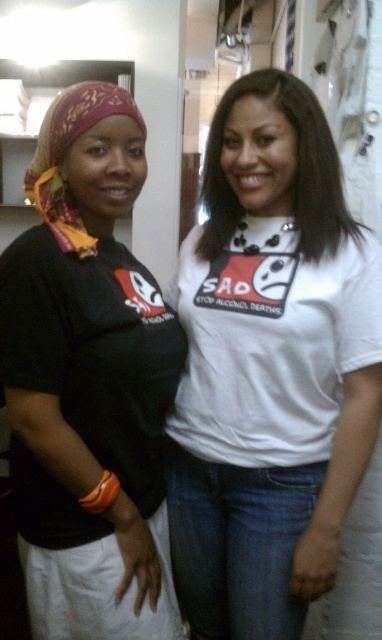
Question: Among these objects, which one is farthest from the camera?

Choices:
 (A) matte black shirt at left
 (B) white matte t-shirt at center

Answer: (B)

Question: Is white matte t-shirt at center further to camera compared to matte black shirt at left?

Choices:
 (A) no
 (B) yes

Answer: (B)

Question: Considering the real-world distances, which object is farthest from the white matte t-shirt at center?

Choices:
 (A) matte black shirt at left
 (B) printed silk headscarf at left

Answer: (B)

Question: In this image, where is white matte t-shirt at center located relative to printed silk headscarf at left?

Choices:
 (A) below
 (B) above

Answer: (A)

Question: Which of the following is the farthest from the observer?

Choices:
 (A) matte black shirt at left
 (B) printed silk headscarf at left
 (C) white matte t-shirt at center

Answer: (C)

Question: Is matte black shirt at left above printed silk headscarf at left?

Choices:
 (A) yes
 (B) no

Answer: (B)